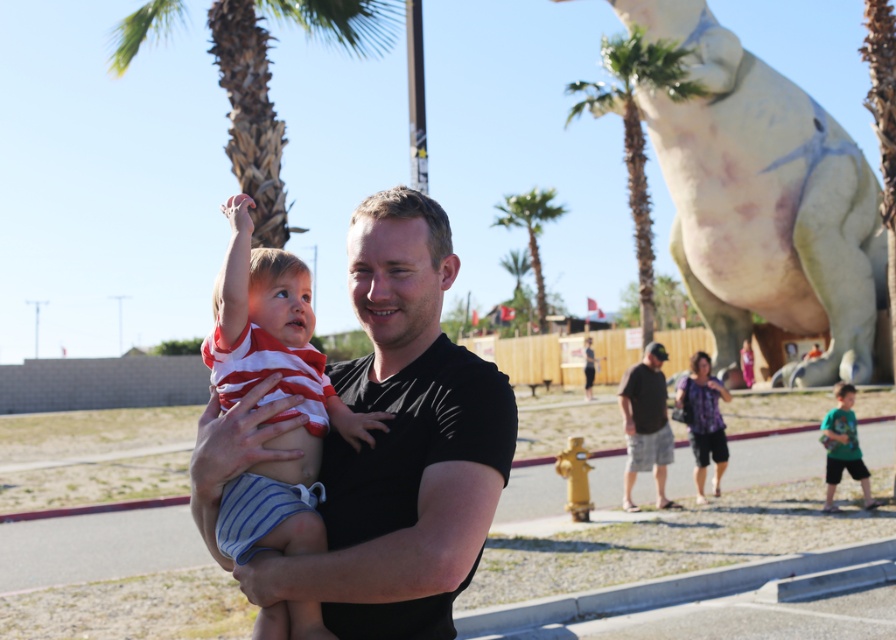
Question: Which point is closer to the camera taking this photo?

Choices:
 (A) (278, 230)
 (B) (876, 208)
 (C) (851, 461)

Answer: (A)

Question: From the image, what is the correct spatial relationship of green leafy palm tree at upper right in relation to green jersey at lower right?

Choices:
 (A) left
 (B) right

Answer: (B)

Question: Which of the following is the farthest from the observer?

Choices:
 (A) green leafy palm tree at upper center
 (B) striped cotton shirt at center

Answer: (A)

Question: Does striped cotton shirt at center come in front of green leafy palm tree at center?

Choices:
 (A) yes
 (B) no

Answer: (A)

Question: Can you confirm if striped cotton shirt at center is bigger than green leafy palm tree at upper right?

Choices:
 (A) no
 (B) yes

Answer: (A)

Question: Which point is closer to the camera?

Choices:
 (A) black cotton shirt at center
 (B) green leafy palm tree at center

Answer: (A)